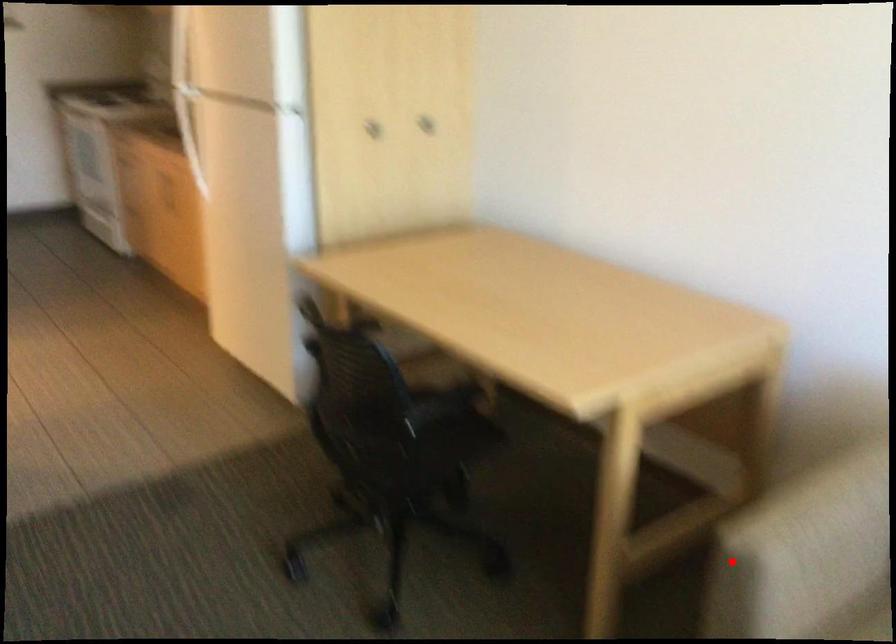
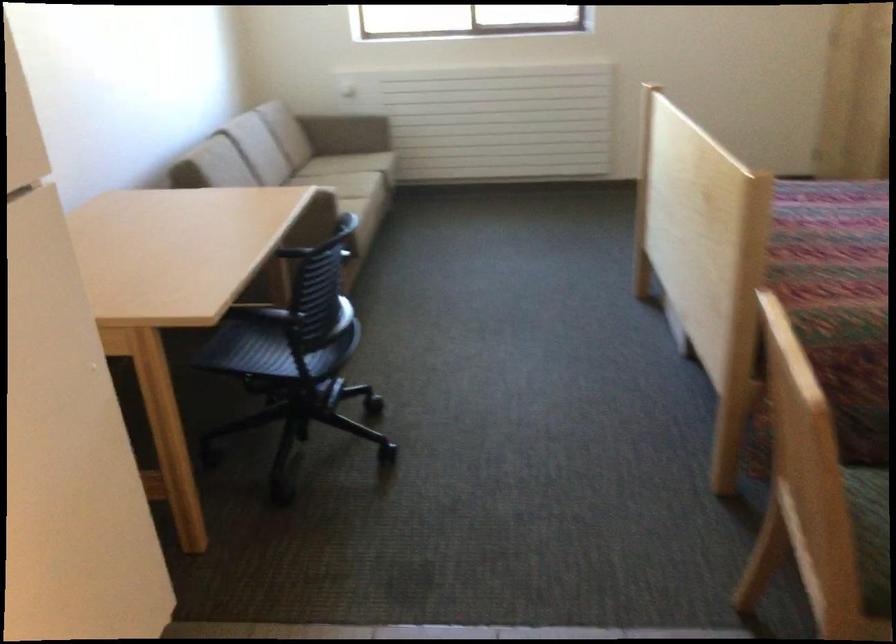
Question: A red point is marked in image1. In image2, is the corresponding 3D point closer to the camera or farther? Reply with the corresponding letter.

Choices:
 (A) The corresponding 3D point is closer.
 (B) The corresponding 3D point is farther.

Answer: (B)